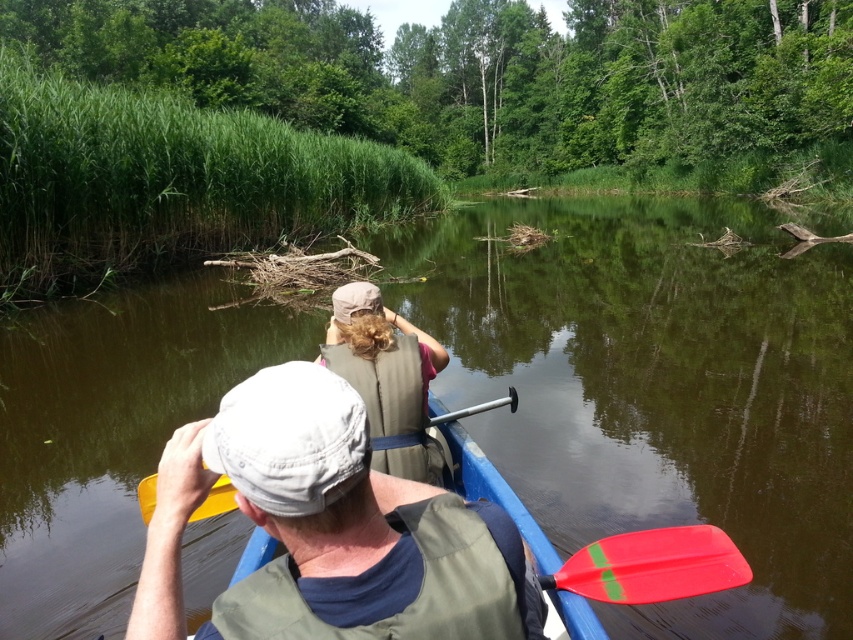
Is brown murky water at center wider than red plastic paddle at lower center?

Yes.

Which is in front, point (541, 515) or point (646, 552)?

Point (646, 552)

Is point (4, 392) more distant than point (610, 595)?

Yes, it is.

You are a GUI agent. You are given a task and a screenshot of the screen. Output one action in this format:
    pyautogui.click(x=<x>, y=<y>)
    Task: Click on the brown murky water at center
    This screenshot has width=853, height=640.
    Given the screenshot: What is the action you would take?
    pyautogui.click(x=656, y=387)

Between point (32, 336) and point (142, 484), which one is positioned in front?

Point (142, 484) is more forward.

Can you confirm if brown murky water at center is positioned above red plastic paddle at center?

Yes, brown murky water at center is above red plastic paddle at center.

This screenshot has width=853, height=640. What do you see at coordinates (656, 387) in the screenshot?
I see `brown murky water at center` at bounding box center [656, 387].

Where is `brown murky water at center`? This screenshot has width=853, height=640. brown murky water at center is located at coordinates (656, 387).

Is point (361, 412) behind point (358, 323)?

That is False.

Can you confirm if matte gray cap at center is smaller than beige fabric life vest at center?

Indeed, matte gray cap at center has a smaller size compared to beige fabric life vest at center.

Is point (287, 470) positioned before point (397, 333)?

Yes, it is.

Locate an element on the screen. The width and height of the screenshot is (853, 640). matte gray cap at center is located at coordinates click(x=289, y=500).